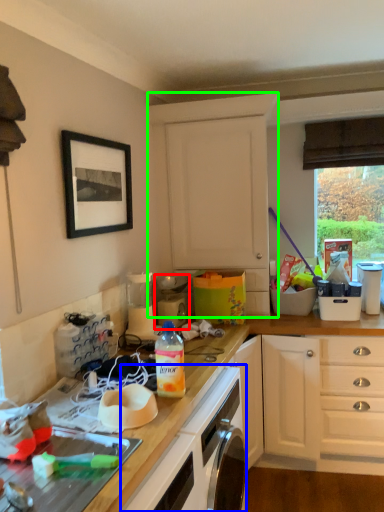
Question: Estimate the real-world distances between objects in this image. Which object is closer to appliance (highlighted by a red box), oven (highlighted by a blue box) or cabinetry (highlighted by a green box)?

Choices:
 (A) oven
 (B) cabinetry

Answer: (B)